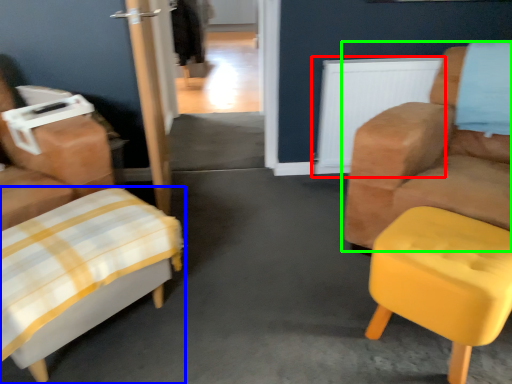
Question: Estimate the real-world distances between objects in this image. Which object is farther from radiator (highlighted by a red box), furniture (highlighted by a blue box) or chair (highlighted by a green box)?

Choices:
 (A) furniture
 (B) chair

Answer: (A)